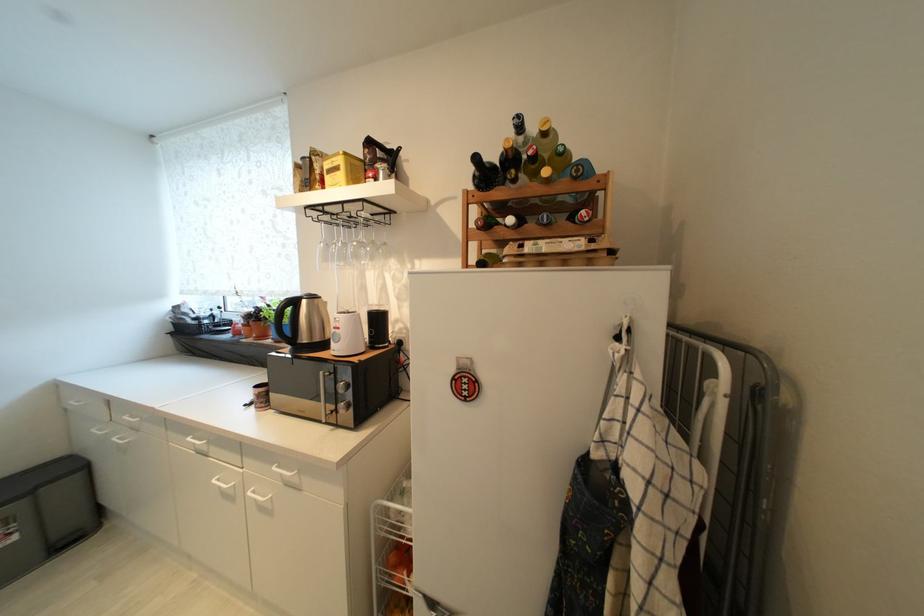
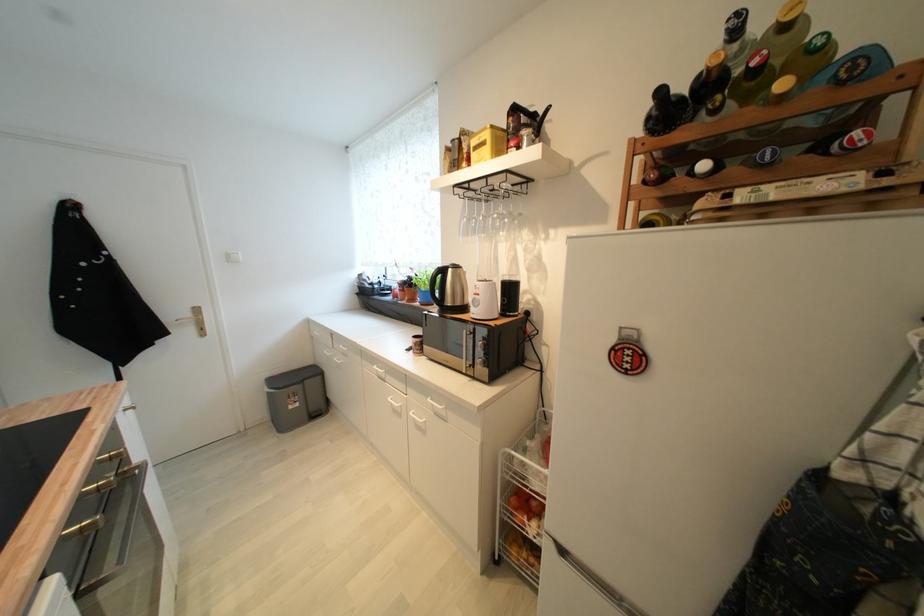
The point at (457, 381) is marked in the first image. Where is the corresponding point in the second image?

(618, 351)